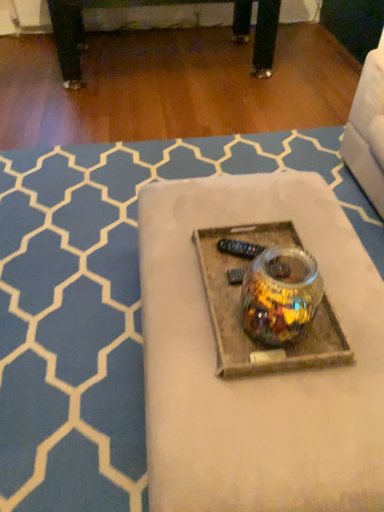
Question: From a real-world perspective, is translucent glass jar at center positioned above or below translucent glass jar at center?

Choices:
 (A) below
 (B) above

Answer: (A)

Question: Is translucent glass jar at center spatially inside translucent glass jar at center, or outside of it?

Choices:
 (A) outside
 (B) inside

Answer: (A)

Question: Based on their positions, is translucent glass jar at center located to the left or right of translucent glass jar at center?

Choices:
 (A) right
 (B) left

Answer: (B)

Question: From a real-world perspective, is translucent glass jar at center physically located above or below translucent glass jar at center?

Choices:
 (A) above
 (B) below

Answer: (A)

Question: Considering the positions of translucent glass jar at center and translucent glass jar at center in the image, is translucent glass jar at center wider or thinner than translucent glass jar at center?

Choices:
 (A) wide
 (B) thin

Answer: (B)

Question: From the image's perspective, is translucent glass jar at center positioned above or below translucent glass jar at center?

Choices:
 (A) below
 (B) above

Answer: (A)

Question: Is translucent glass jar at center inside the boundaries of translucent glass jar at center, or outside?

Choices:
 (A) outside
 (B) inside

Answer: (A)